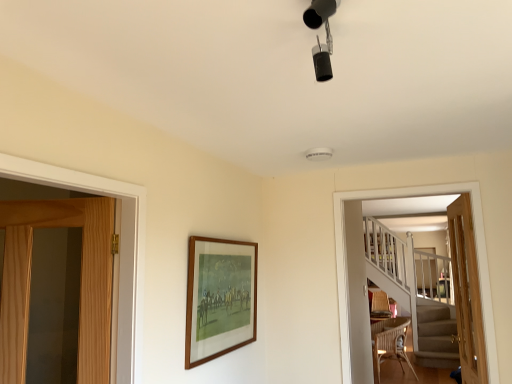
Locate an element on the screen. This screenshot has height=384, width=512. wooden frame at center is located at coordinates (219, 298).

How much space does light brown wooden door at left, which is counted as the first door, starting from the left, occupy horizontally?

light brown wooden door at left, which is counted as the first door, starting from the left, is 32.88 inches in width.

Describe the element at coordinates (318, 37) in the screenshot. This screenshot has height=384, width=512. I see `matte black track lights at upper center` at that location.

The image size is (512, 384). In order to click on wicker armchair at lower right in this screenshot , I will do `click(379, 305)`.

Measure the distance between point [457,205] and camera.

The distance of point [457,205] from camera is 8.84 feet.

What do you see at coordinates (476, 252) in the screenshot?
I see `wooden screen door at right` at bounding box center [476, 252].

Find the location of a particular element. This screenshot has width=512, height=384. wooden screen door at right is located at coordinates (476, 252).

Where is `woven brown chair at lower right`? This screenshot has width=512, height=384. woven brown chair at lower right is located at coordinates (390, 343).

Which is in front, point (347, 365) or point (397, 349)?

The point (347, 365) is more forward.

Is wooden screen door at right at the left side of woven brown chair at lower right?

Yes, wooden screen door at right is to the left of woven brown chair at lower right.

Is wooden screen door at right spatially inside woven brown chair at lower right, or outside of it?

wooden screen door at right is spatially situated outside woven brown chair at lower right.

Considering the relative sizes of wooden screen door at right and woven brown chair at lower right in the image provided, is wooden screen door at right wider than woven brown chair at lower right?

Incorrect, the width of wooden screen door at right does not surpass that of woven brown chair at lower right.

Is wooden frame at center next to wooden screen door at right and touching it?

wooden frame at center and wooden screen door at right are not in contact.

Could you tell me if wooden frame at center is facing wooden screen door at right?

Yes, wooden frame at center is turned towards wooden screen door at right.

From the image's perspective, which one is positioned higher, wooden frame at center or wooden screen door at right?

From the image's view, wooden frame at center is above.

Which is more to the left, wooden frame at center or wooden screen door at right?

From the viewer's perspective, wooden frame at center appears more on the left side.

Is light brown wooden door at left, which is counted as the first door, starting from the left, touching matte black track lights at upper center?

No, light brown wooden door at left, which is counted as the first door, starting from the left, is not next to matte black track lights at upper center.

Which is behind, point (105, 364) or point (306, 25)?

The point (105, 364) is farther from the camera.

Is light brown wooden door at left, which is counted as the first door, starting from the left, oriented away from matte black track lights at upper center?

That's not correct — light brown wooden door at left, which is counted as the first door, starting from the left, is not looking away from matte black track lights at upper center.

Considering the sizes of objects light brown wooden door at left, which is counted as the first door, starting from the left, and matte black track lights at upper center in the image provided, who is smaller, light brown wooden door at left, which is counted as the first door, starting from the left, or matte black track lights at upper center?

matte black track lights at upper center.

Is matte black track lights at upper center next to woven brown chair at lower right?

There is a gap between matte black track lights at upper center and woven brown chair at lower right.

Is matte black track lights at upper center situated inside woven brown chair at lower right or outside?

matte black track lights at upper center lies outside woven brown chair at lower right.

Measure the distance between matte black track lights at upper center and woven brown chair at lower right.

matte black track lights at upper center and woven brown chair at lower right are 4.39 meters apart from each other.

Visually, is matte black track lights at upper center positioned to the left or to the right of woven brown chair at lower right?

From the image, it's evident that matte black track lights at upper center is to the left of woven brown chair at lower right.

Between wooden frame at center and light wood door at right, the 2th door viewed from the left, which one is positioned behind?

light wood door at right, the 2th door viewed from the left.

Can you tell me how much wooden frame at center and light wood door at right, which is the first door in right-to-left order, differ in facing direction?

The facing directions of wooden frame at center and light wood door at right, which is the first door in right-to-left order, are 180 degrees apart.

From the image's perspective, would you say wooden frame at center is shown under light wood door at right, the 2th door viewed from the left?

No, from the image's perspective, wooden frame at center is not below light wood door at right, the 2th door viewed from the left.

In the scene shown: Is wooden frame at center not near light wood door at right, which is the first door in right-to-left order?

Yes, wooden frame at center and light wood door at right, which is the first door in right-to-left order, are located far from each other.

Which of these two, light brown wooden door at left, which is counted as the first door, starting from the left, or wooden screen door at right, is wider?

With larger width is light brown wooden door at left, which is counted as the first door, starting from the left.

Considering the sizes of objects light brown wooden door at left, which is counted as the first door, starting from the left, and wooden screen door at right in the image provided, who is smaller, light brown wooden door at left, which is counted as the first door, starting from the left, or wooden screen door at right?

With smaller size is wooden screen door at right.

From the image's perspective, would you say light brown wooden door at left, which is counted as the first door, starting from the left, is positioned over wooden screen door at right?

No, from the image's perspective, light brown wooden door at left, which is counted as the first door, starting from the left, is not above wooden screen door at right.

Is wicker armchair at lower right surrounding light wood door at right, which is the first door in right-to-left order?

No, light wood door at right, which is the first door in right-to-left order, is not a part of wicker armchair at lower right.

Which is less distant, (384, 301) or (461, 228)?

The point (461, 228) is more forward.

From the image's perspective, which object appears higher, wicker armchair at lower right or light wood door at right, the 2th door viewed from the left?

light wood door at right, the 2th door viewed from the left, is shown above in the image.

Would you consider wicker armchair at lower right to be distant from light wood door at right, the 2th door viewed from the left?

Yes.

This screenshot has height=384, width=512. What are the coordinates of `screen door above the woven brown chair at lower right (from a real-world perspective)` in the screenshot? It's located at (476, 252).

Identify the location of picture frame that is on the left side of wooden screen door at right. Image resolution: width=512 pixels, height=384 pixels. pos(219,298).

Looking at the image, which one is located further to wicker armchair at lower right, matte black track lights at upper center or wooden screen door at right?

matte black track lights at upper center lies further to wicker armchair at lower right than the other object.

In the scene shown: When comparing their distances from light wood door at right, which is the first door in right-to-left order, does wooden frame at center or wooden screen door at right seem further?

Among the two, wooden frame at center is located further to light wood door at right, which is the first door in right-to-left order.

Considering their positions, is light wood door at right, the 2th door viewed from the left, positioned closer to woven brown chair at lower right than matte black track lights at upper center?

The object closer to woven brown chair at lower right is light wood door at right, the 2th door viewed from the left.

Looking at the image, which one is located further to matte black track lights at upper center, light wood door at right, the 2th door viewed from the left, or wooden frame at center?

The object further to matte black track lights at upper center is light wood door at right, the 2th door viewed from the left.

Which object lies further to the anchor point woven brown chair at lower right, wooden screen door at right or matte black track lights at upper center?

matte black track lights at upper center.

From the image, which object appears to be farther from wooden screen door at right, woven brown chair at lower right or matte black track lights at upper center?

Based on the image, woven brown chair at lower right appears to be further to wooden screen door at right.

Which object lies nearer to the anchor point light wood door at right, which is the first door in right-to-left order, light brown wooden door at left, which appears as the second door when viewed from the right, or wooden frame at center?

Based on the image, wooden frame at center appears to be nearer to light wood door at right, which is the first door in right-to-left order.

Which object lies nearer to the anchor point matte black track lights at upper center, light brown wooden door at left, which appears as the second door when viewed from the right, or light wood door at right, the 2th door viewed from the left?

light brown wooden door at left, which appears as the second door when viewed from the right, is closer to matte black track lights at upper center.

Where is `screen door located between matte black track lights at upper center and woven brown chair at lower right in the depth direction`? The image size is (512, 384). screen door located between matte black track lights at upper center and woven brown chair at lower right in the depth direction is located at coordinates (476, 252).

This screenshot has height=384, width=512. What are the coordinates of `chair between wooden screen door at right and wicker armchair at lower right along the z-axis` in the screenshot? It's located at pyautogui.click(x=390, y=343).

Locate an element on the screen. The height and width of the screenshot is (384, 512). light fixture between wooden frame at center and light wood door at right, the 2th door viewed from the left, in the horizontal direction is located at coordinates 318,37.

The height and width of the screenshot is (384, 512). I want to click on door located between wooden screen door at right and wicker armchair at lower right in the depth direction, so click(x=466, y=292).